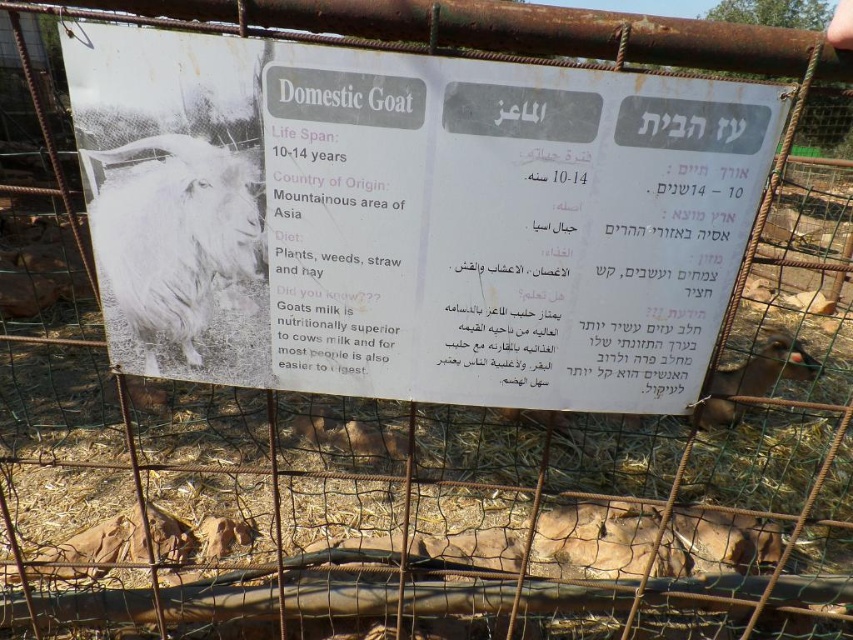
Question: Is white paper sign at center to the left of brown furry goat at center from the viewer's perspective?

Choices:
 (A) no
 (B) yes

Answer: (B)

Question: Is white paper sign at center thinner than white fluffy goat at upper left?

Choices:
 (A) yes
 (B) no

Answer: (B)

Question: Observing the image, what is the correct spatial positioning of white fluffy goat at upper left in reference to brown furry goat at center?

Choices:
 (A) above
 (B) below

Answer: (A)

Question: Which object is closer to the camera taking this photo?

Choices:
 (A) white paper sign at center
 (B) brown furry goat at center

Answer: (A)

Question: Among these objects, which one is nearest to the camera?

Choices:
 (A) brown furry goat at center
 (B) white paper sign at center
 (C) white fluffy goat at upper left

Answer: (B)

Question: Which of the following is the farthest from the observer?

Choices:
 (A) white paper sign at center
 (B) brown furry goat at center

Answer: (B)